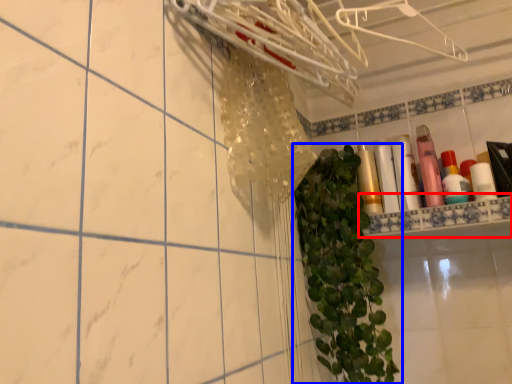
Question: Which point is further to the camera, ledge (highlighted by a red box) or houseplant (highlighted by a blue box)?

Choices:
 (A) ledge
 (B) houseplant

Answer: (A)